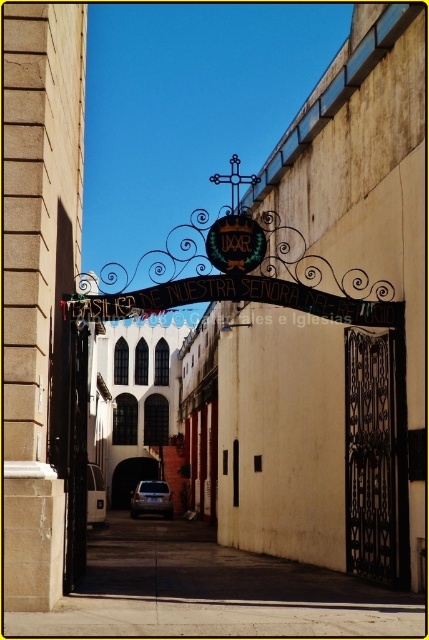
Which is more to the left, black metal gate at lower left or metallic silver car at center?

metallic silver car at center

Who is lower down, black metal gate at lower left or metallic silver car at center?

metallic silver car at center

Locate an element on the screen. black metal gate at lower left is located at coordinates (76, 456).

Does point (368, 380) come closer to viewer compared to point (69, 502)?

No.

Which is more to the left, black wrought iron gate at center or black metal gate at lower left?

black metal gate at lower left is more to the left.

Who is more distant from viewer, (392, 564) or (72, 545)?

Positioned behind is point (72, 545).

Find the location of `black wrought iron gate at center`. black wrought iron gate at center is located at coordinates (374, 456).

How far apart are black wrought iron gate at center and metallic silver car at center?

A distance of 107.63 meters exists between black wrought iron gate at center and metallic silver car at center.

Is black wrought iron gate at center positioned in front of metallic silver car at center?

Yes, it is.

Is point (368, 496) behind point (165, 516)?

No, it is not.

The width and height of the screenshot is (429, 640). Find the location of `black wrought iron gate at center`. black wrought iron gate at center is located at coordinates (374, 456).